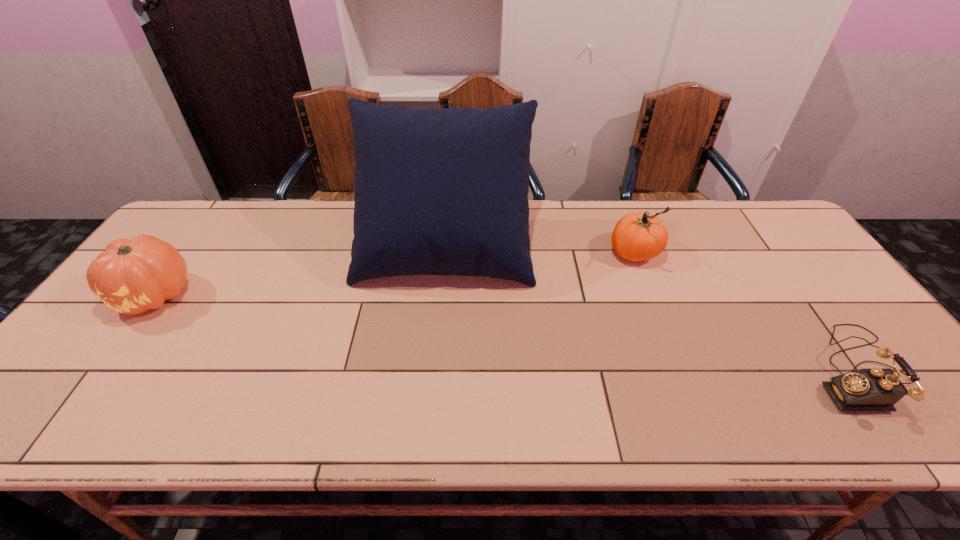
The width and height of the screenshot is (960, 540). What are the coordinates of `free region at the far edge` in the screenshot? It's located at (324, 239).

Where is `vacant area at the near edge of the desktop`? This screenshot has width=960, height=540. vacant area at the near edge of the desktop is located at coordinates (114, 437).

Find the location of a particular element. The height and width of the screenshot is (540, 960). vacant space at the right edge of the desktop is located at coordinates (842, 318).

Locate an element on the screen. free space between the rightmost object and the leftmost object is located at coordinates (506, 333).

Image resolution: width=960 pixels, height=540 pixels. Identify the location of empty location between the second object from left to right and the taller pumpkin. (540, 250).

Where is `free space between the rightmost object and the third shortest object`? This screenshot has width=960, height=540. free space between the rightmost object and the third shortest object is located at coordinates (746, 312).

What are the coordinates of `empty space between the shortest object and the second object from left to right` in the screenshot? It's located at (651, 308).

The width and height of the screenshot is (960, 540). I want to click on free space between the shortest object and the shorter pumpkin, so click(506, 333).

The width and height of the screenshot is (960, 540). In order to click on free space between the second object from left to right and the rightmost object in this screenshot , I will do `click(651, 308)`.

I want to click on unoccupied area between the cushion and the leftmost object, so click(300, 271).